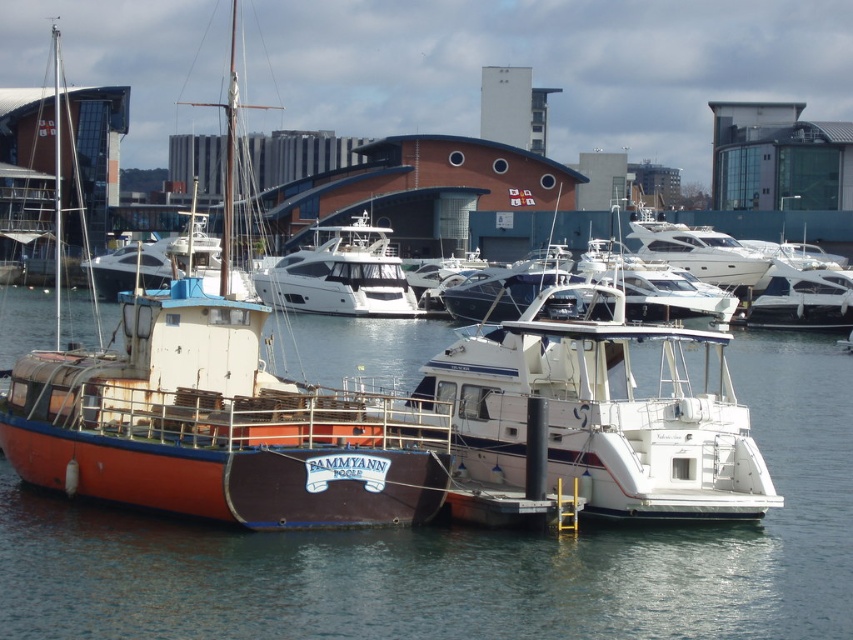
Which is more to the left, smooth water at center or white glossy boat at center?

From the viewer's perspective, smooth water at center appears more on the left side.

Identify the location of smooth water at center. (471, 554).

Is smooth water at center above rusty metal boat at left?

No, smooth water at center is not above rusty metal boat at left.

Is smooth water at center closer to camera compared to rusty metal boat at left?

Yes, it is in front of rusty metal boat at left.

Does point (206, 584) lie in front of point (120, 374)?

Yes, point (206, 584) is in front of point (120, 374).

You are a GUI agent. You are given a task and a screenshot of the screen. Output one action in this format:
    pyautogui.click(x=<x>, y=<y>)
    Task: Click on the smooth water at center
    
    Given the screenshot: What is the action you would take?
    pyautogui.click(x=471, y=554)

Is white glossy boat at center shorter than white glossy yacht at center?

Yes, white glossy boat at center is shorter than white glossy yacht at center.

Which is in front, point (720, 424) or point (393, 307)?

Point (720, 424) is in front.

Between point (704, 419) and point (334, 304), which one is positioned in front?

Point (704, 419) is in front.

Identify the location of white glossy boat at center. (599, 417).